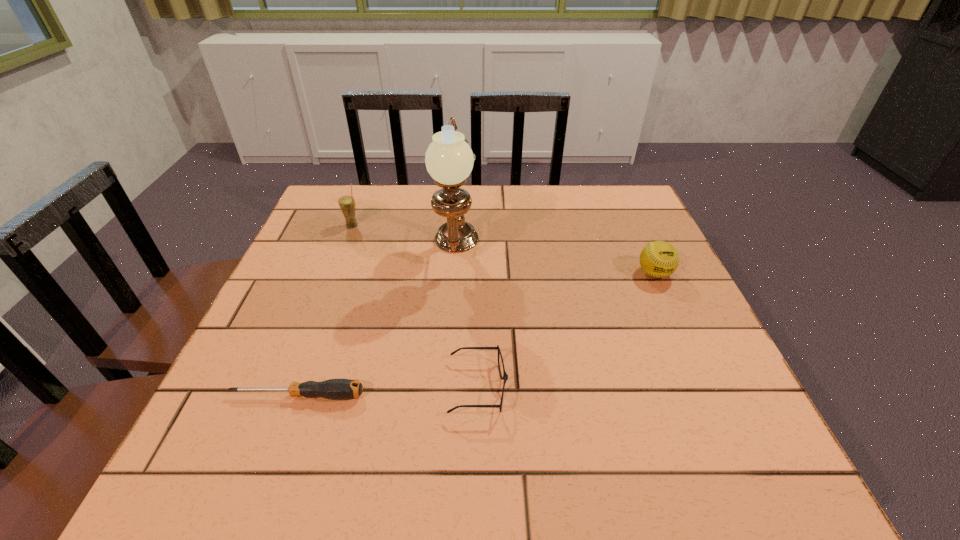
Where is `the tallest object`? This screenshot has width=960, height=540. the tallest object is located at coordinates (449, 160).

What are the coordinates of `straw for drinking` in the screenshot? It's located at (347, 204).

The image size is (960, 540). I want to click on the rightmost object, so click(x=659, y=259).

Locate an element on the screen. The height and width of the screenshot is (540, 960). softball is located at coordinates (659, 259).

In order to click on spectacles in this screenshot , I will do `click(505, 377)`.

In order to click on screwdriver in this screenshot , I will do `click(334, 389)`.

The height and width of the screenshot is (540, 960). In order to click on free region located 0.200m on the right of the oil lamp in this screenshot , I will do (559, 254).

Image resolution: width=960 pixels, height=540 pixels. Identify the location of free space located 0.160m on the front of the fourth shortest object. (336, 268).

The image size is (960, 540). I want to click on free point located 0.120m on the logo side of the softball, so click(x=678, y=324).

At what (x,y) coordinates should I click in order to perform the action: click on free spot located on the front-facing side of the spectacles. Please return your answer as a coordinate pair (x, y). Image resolution: width=960 pixels, height=540 pixels. Looking at the image, I should click on (711, 388).